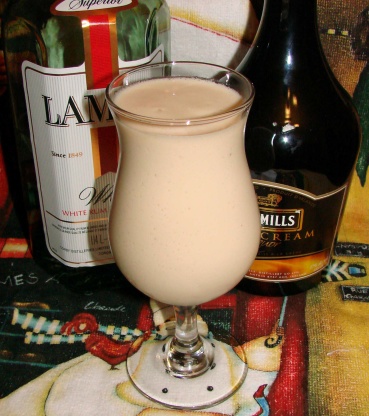
In order to click on bottle in this screenshot , I will do `click(316, 141)`, `click(58, 44)`.